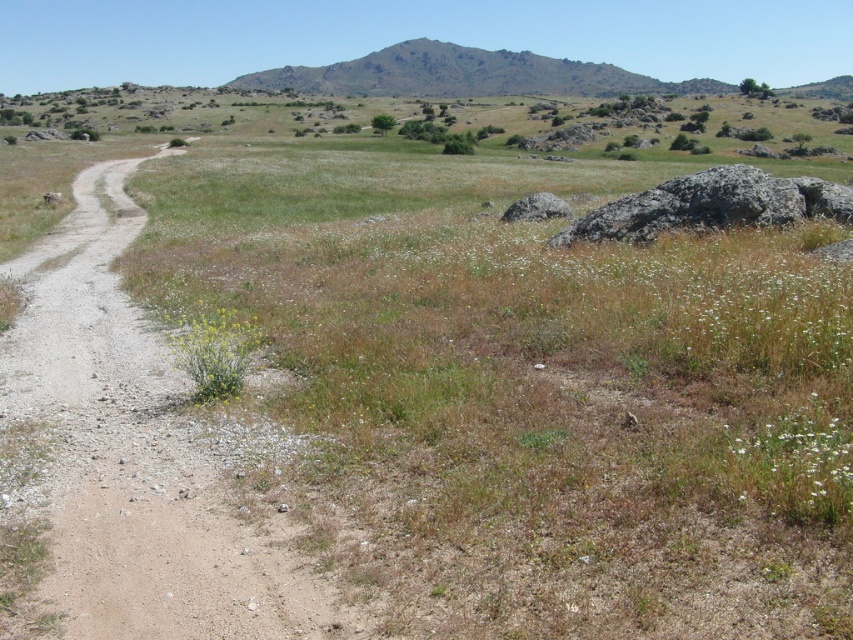
Question: Which object is closer to the camera taking this photo?

Choices:
 (A) brown gravel dirt track at left
 (B) gray rough rock at right
 (C) yellow-green leafy plant at lower left

Answer: (A)

Question: Which point is closer to the camera?

Choices:
 (A) gray rough rock at right
 (B) brown gravel dirt track at left

Answer: (B)

Question: Considering the relative positions of brown gravel dirt track at left and gray rough rock at right in the image provided, where is brown gravel dirt track at left located with respect to gray rough rock at right?

Choices:
 (A) below
 (B) above

Answer: (A)

Question: Among these points, which one is farthest from the camera?

Choices:
 (A) (210, 561)
 (B) (741, 221)

Answer: (B)

Question: Is brown gravel dirt track at left bigger than gray rough rock at right?

Choices:
 (A) no
 (B) yes

Answer: (B)

Question: Can you confirm if gray rough rock at right is wider than yellow-green leafy plant at lower left?

Choices:
 (A) yes
 (B) no

Answer: (A)